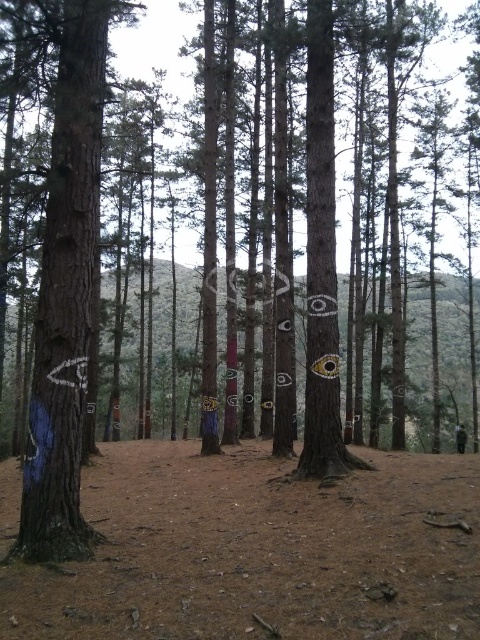
Question: Can you confirm if blue painted tree trunk at left is positioned to the left of black leather jacket at center?

Choices:
 (A) yes
 (B) no

Answer: (A)

Question: Which of the following is the closest to the observer?

Choices:
 (A) black leather jacket at center
 (B) blue painted tree trunk at left

Answer: (B)

Question: Which point appears closest to the camera in this image?

Choices:
 (A) (462, 433)
 (B) (60, 316)

Answer: (B)

Question: Is blue painted tree trunk at left bigger than black leather jacket at center?

Choices:
 (A) no
 (B) yes

Answer: (B)

Question: Can you confirm if blue painted tree trunk at left is bigger than black leather jacket at center?

Choices:
 (A) no
 (B) yes

Answer: (B)

Question: Which object is farther from the camera taking this photo?

Choices:
 (A) black leather jacket at center
 (B) blue painted tree trunk at left

Answer: (A)